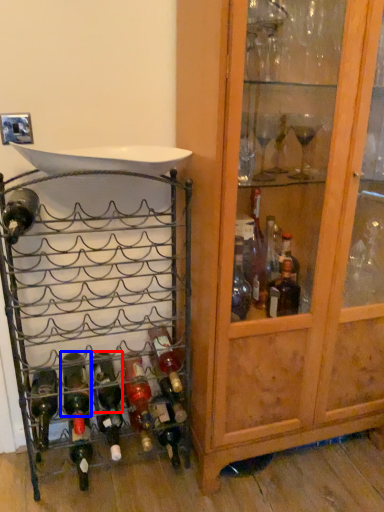
Question: Among these objects, which one is nearest to the camera, bottle (highlighted by a red box) or bottle (highlighted by a blue box)?

Choices:
 (A) bottle
 (B) bottle

Answer: (B)